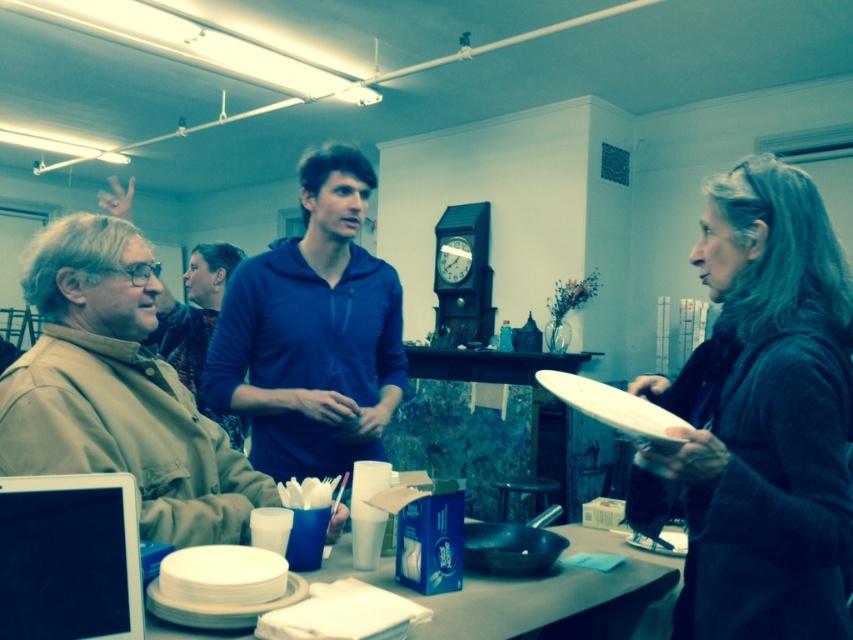
Question: Among these objects, which one is farthest from the camera?

Choices:
 (A) white matte plate at lower left
 (B) white matte paper plate at upper right
 (C) dark gray sweater at right

Answer: (B)

Question: Can you confirm if khaki fabric jacket at left is positioned below white paper plates at center?

Choices:
 (A) no
 (B) yes

Answer: (A)

Question: Which point appears closest to the camera in this image?

Choices:
 (A) (659, 435)
 (B) (248, 627)
 (C) (799, 225)
 (D) (115, 387)

Answer: (B)

Question: Does blue zip-up hoodie at center appear over white matte plate at lower left?

Choices:
 (A) no
 (B) yes

Answer: (B)

Question: Is khaki fabric jacket at left further to camera compared to blue zip-up hoodie at center?

Choices:
 (A) no
 (B) yes

Answer: (A)

Question: Which point is closer to the camera?

Choices:
 (A) (67, 234)
 (B) (793, 616)
 (C) (670, 426)

Answer: (B)